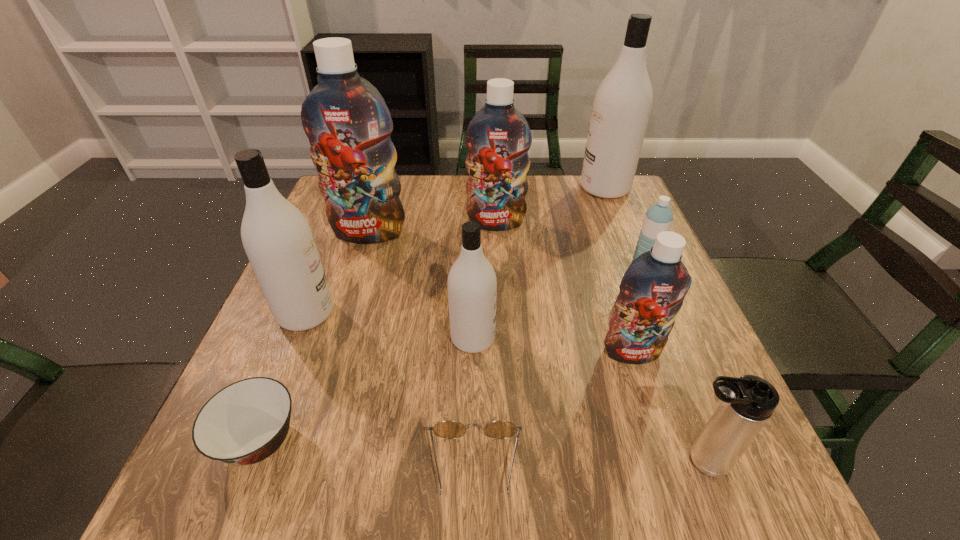
Identify which object is the nearest to the blue water bottle. Please provide its 2D coordinates. Your answer should be formatted as a tuple, i.e. [(x, y)], where the tuple contains the x and y coordinates of a point satisfying the conditions above.

[(652, 290)]

The height and width of the screenshot is (540, 960). Identify the location of the second closest shampoo to the thermos bottle. (472, 284).

Locate an element on the screen. Image resolution: width=960 pixels, height=540 pixels. the third closest shampoo to the farthest object is located at coordinates (652, 290).

Image resolution: width=960 pixels, height=540 pixels. I want to click on the third closest white shampoo to the thermos bottle, so 622,104.

Find the location of `white shampoo object that ranks as the second closest to the blue water bottle`. white shampoo object that ranks as the second closest to the blue water bottle is located at coordinates (472, 284).

Locate which blue shampoo ranks in proximity to the blue water bottle. Please provide its 2D coordinates. Your answer should be formatted as a tuple, i.e. [(x, y)], where the tuple contains the x and y coordinates of a point satisfying the conditions above.

[(652, 290)]

What are the coordinates of `blue shampoo that can be found as the second closest to the second blue shampoo from left to right` in the screenshot? It's located at coord(652,290).

This screenshot has width=960, height=540. I want to click on vacant space that satisfies the following two spatial constraints: 1. on the front label of the second biggest blue shampoo; 2. on the front-facing side of the smallest white shampoo, so click(x=501, y=338).

Where is `vacant region that satisfies the following two spatial constraints: 1. on the handle side of the thermos bottle; 2. on the front-facing side of the spectacles`? vacant region that satisfies the following two spatial constraints: 1. on the handle side of the thermos bottle; 2. on the front-facing side of the spectacles is located at coordinates click(702, 467).